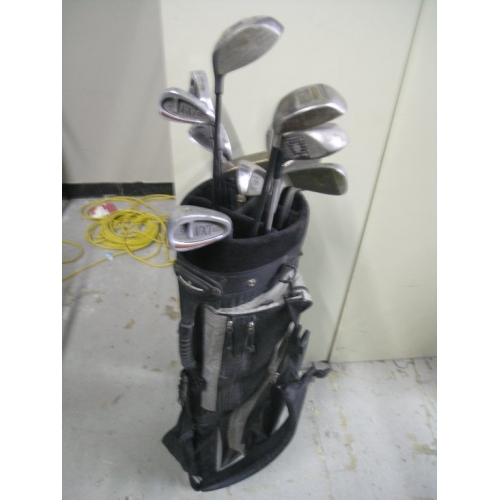
This screenshot has width=500, height=500. Identify the location of floor. (364, 394).